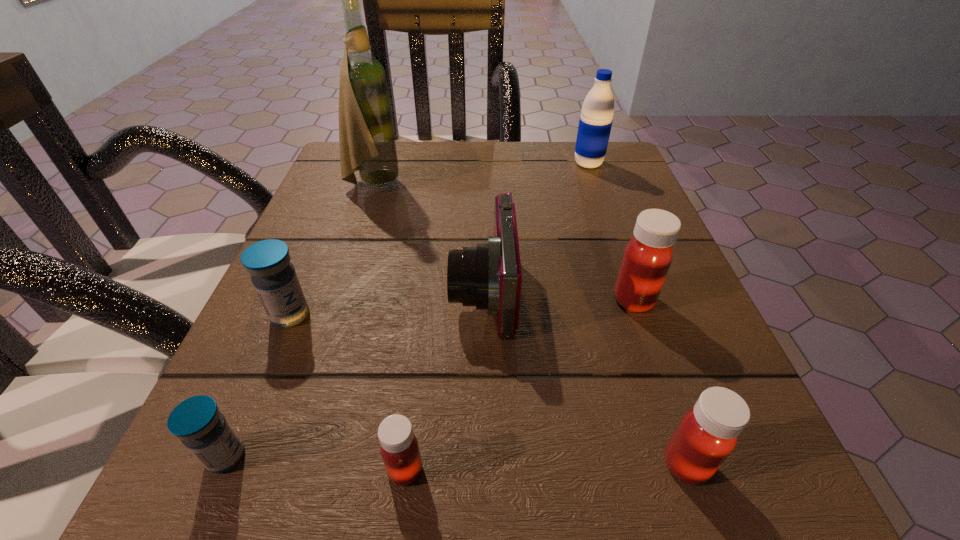
This screenshot has height=540, width=960. What are the coordinates of `vacant area that lies between the third medicine from right to left and the nearer blue medicine` in the screenshot? It's located at (316, 463).

Image resolution: width=960 pixels, height=540 pixels. I want to click on free space between the farthest red medicine and the bigger blue medicine, so click(x=462, y=307).

Locate an element on the screen. unoccupied area between the seventh shortest object and the fourth object from right to left is located at coordinates (536, 228).

Identify the location of free spot between the smaller blue medicine and the farthest red medicine. (430, 378).

Find the location of `free point between the camera and the bigger blue medicine`. free point between the camera and the bigger blue medicine is located at coordinates (387, 303).

I want to click on free space between the nearer blue medicine and the second smallest red medicine, so click(x=456, y=460).

Select which object appears as the fifth closest to the smallest red medicine. Please provide its 2D coordinates. Your answer should be formatted as a tuple, i.e. [(x, y)], where the tuple contains the x and y coordinates of a point satisfying the conditions above.

[(648, 255)]

Locate an element on the screen. This screenshot has height=540, width=960. object that is the closest to the camera is located at coordinates (648, 255).

This screenshot has width=960, height=540. What are the coordinates of `medicine that can be found as the second closest to the second biggest red medicine` in the screenshot? It's located at (399, 448).

Identify the location of the closest medicine to the nearer blue medicine. This screenshot has width=960, height=540. (399, 448).